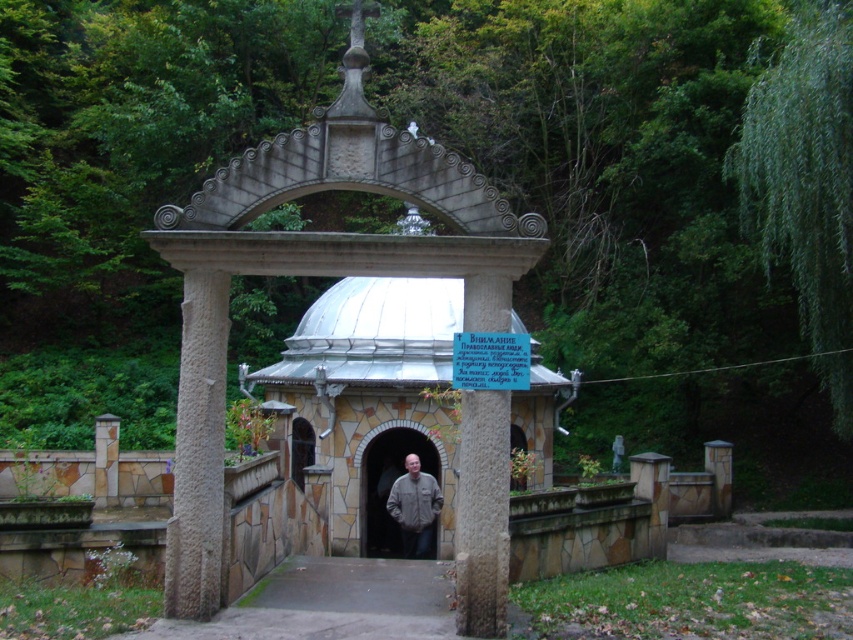
You are standing at the camera position and want to walk directly to the point marked at coordinates (508, 305). How far will you have to walk?

The point marked at coordinates (508, 305) is 7.87 meters away from the camera, so you will have to walk 7.87 meters to reach it.